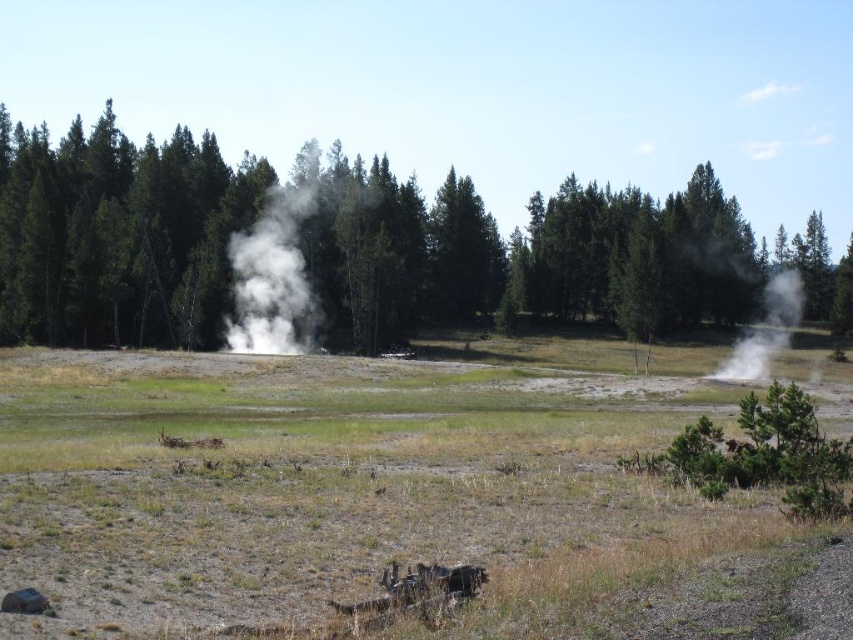
Does point (291, 307) lie in front of point (759, 339)?

Yes, it is.

Between white vapor at center and white vapor steam at right, which one has more height?

white vapor at center

Is point (234, 275) positioned behind point (775, 346)?

No, (234, 275) is closer to viewer.

Where is `white vapor at center`? The height and width of the screenshot is (640, 853). white vapor at center is located at coordinates (276, 268).

Which is more to the right, green matte tree at center or white vapor steam at right?

white vapor steam at right

Which of these two, green matte tree at center or white vapor steam at right, stands taller?

green matte tree at center is taller.

Measure the distance between green matte tree at center and camera.

The distance of green matte tree at center from camera is 222.65 feet.

Find the location of `green matte tree at center`. green matte tree at center is located at coordinates (524, 257).

Which is below, green matte tree at center or white vapor at center?

white vapor at center is lower down.

Who is positioned more to the right, green matte tree at center or white vapor at center?

Positioned to the right is white vapor at center.

Is point (207, 252) positioned before point (238, 332)?

No, it is behind (238, 332).

At what (x,y) coordinates should I click in order to perform the action: click on green matte tree at center. Please return your answer as a coordinate pair (x, y). Looking at the image, I should click on (524, 257).